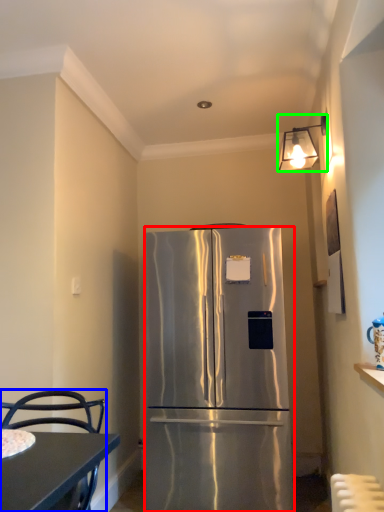
Question: Which object is positioned closest to refrigerator (highlighted by a red box)? Select from chair (highlighted by a blue box) and lamp (highlighted by a green box).

Choices:
 (A) chair
 (B) lamp

Answer: (A)